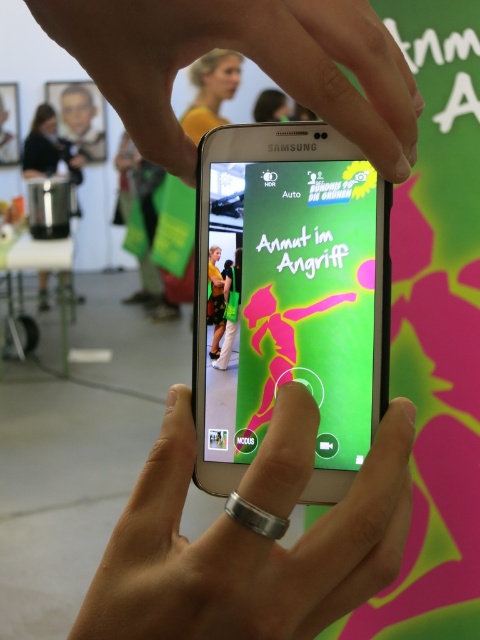
Does green fabric pants at center have a lesser width compared to yellow fabric bag at center?

Incorrect, green fabric pants at center's width is not less than yellow fabric bag at center's.

Who is more distant from viewer, (x=226, y=301) or (x=219, y=275)?

Point (x=219, y=275)

This screenshot has height=640, width=480. In order to click on green fabric pants at center in this screenshot , I will do click(x=229, y=308).

Is point (394, 442) positioned after point (276, 116)?

No, (394, 442) is in front of (276, 116).

Does point (213, 534) come behind point (259, 116)?

No, it is in front of (259, 116).

Locate an element on the screen. The image size is (480, 640). silver metallic ring at center is located at coordinates (247, 550).

Measure the distance between point (217, 282) and camera.

A distance of 16.08 inches exists between point (217, 282) and camera.

Between yellow fabric bag at center and blonde hair at upper center, which one appears on the right side from the viewer's perspective?

Positioned to the right is blonde hair at upper center.

Does point (215, 310) come farther from viewer compared to point (286, 97)?

No.

At what (x,y) coordinates should I click in order to perform the action: click on yellow fabric bag at center. Please return your answer as a coordinate pair (x, y). Looking at the image, I should click on (216, 300).